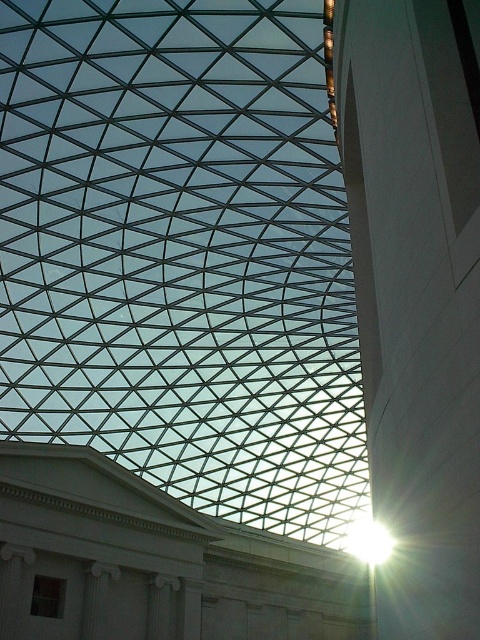
You are standing in the modern building and want to walk from the entrance to the right side wall. You see the transparent glass roof at center and the white glossy pillar at right. Which object will you pass first?

You will pass the transparent glass roof at center first because it is located to the left of the white glossy pillar at right, so you would encounter it before reaching the pillar.

You are an architect examining the building interior. You notice the transparent glass roof at center and the white glossy pillar at right. Which object is closer to your current position?

The transparent glass roof at center is closer to you than the white glossy pillar at right.

Based on the photo, you are standing at the entrance of the modern building and want to reach a specific point marked at coordinates point [137,156]. If your current distance from the camera is 100 feet, can you reach the point without moving closer than 10 feet to it?

The distance of point [137,156] from camera is 107.09 feet. Since you are currently 100 feet away from the camera, you need to move an additional 7.09 feet towards the point to reach it. However, moving closer than 10 feet to the point would require getting within 10 feet, but since the required distance to reach it is only 7.09 feet, you can reach the point without violating the 10 feet minimum distance requirement.